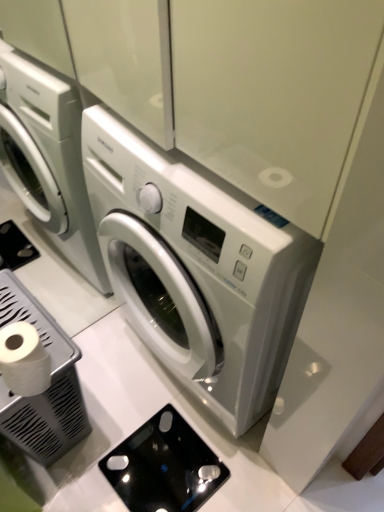
Question: From a real-world perspective, is white glossy washing machine at center above or below black glass scale at lower center, acting as the 2th appliance starting from the left?

Choices:
 (A) below
 (B) above

Answer: (B)

Question: Considering the positions of white glossy washing machine at center and black glass scale at lower center, which is the first appliance in right-to-left order, in the image, is white glossy washing machine at center bigger or smaller than black glass scale at lower center, which is the first appliance in right-to-left order,?

Choices:
 (A) big
 (B) small

Answer: (A)

Question: Which of these objects is positioned farthest from the white plastic trash can at lower left, which is counted as the first appliance, starting from the left?

Choices:
 (A) white matte toilet paper at lower left
 (B) black glass scale at lower center, which is the first appliance in right-to-left order
 (C) white glossy washing machine at center

Answer: (C)

Question: Which object is the farthest from the black glass scale at lower center, acting as the 2th appliance starting from the left?

Choices:
 (A) white plastic trash can at lower left, which is counted as the first appliance, starting from the left
 (B) white matte toilet paper at lower left
 (C) white glossy washing machine at center

Answer: (B)